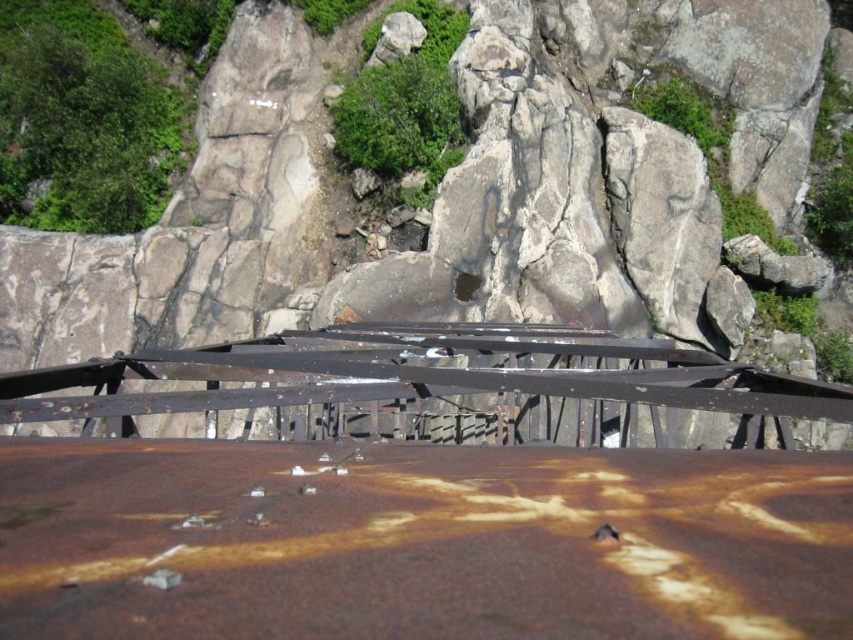
Question: Which object is positioned closest to the rusty metal bridge at center?

Choices:
 (A) rusty metal railing at center
 (B) rusty metal surface at center

Answer: (A)

Question: Which point is farther from the camera taking this photo?

Choices:
 (A) (519, 497)
 (B) (814, 381)

Answer: (B)

Question: Which point is closer to the camera taking this photo?

Choices:
 (A) (547, 99)
 (B) (654, 445)
 (C) (679, 499)

Answer: (C)

Question: Is rusty metal railing at center below rusty metal bridge at center?

Choices:
 (A) no
 (B) yes

Answer: (A)

Question: Does rusty metal railing at center appear on the right side of rusty metal bridge at center?

Choices:
 (A) no
 (B) yes

Answer: (B)

Question: Is rusty metal surface at center to the right of rusty metal bridge at center from the viewer's perspective?

Choices:
 (A) yes
 (B) no

Answer: (A)